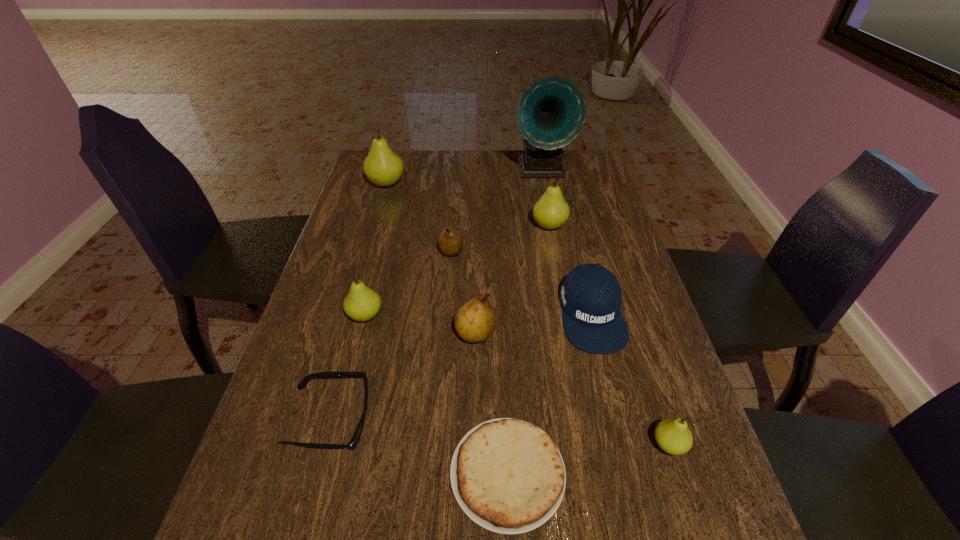
The width and height of the screenshot is (960, 540). Find the location of `the tallest object`. the tallest object is located at coordinates (551, 112).

This screenshot has height=540, width=960. Find the location of `the biggest green pear`. the biggest green pear is located at coordinates (383, 167).

At what (x,y) coordinates should I click in order to perform the action: click on the farthest green pear. Please return your answer as a coordinate pair (x, y). The image size is (960, 540). Looking at the image, I should click on (383, 167).

Image resolution: width=960 pixels, height=540 pixels. I want to click on the third farthest object, so click(x=551, y=211).

This screenshot has height=540, width=960. In order to click on the fifth shortest pear in this screenshot , I will do `click(551, 211)`.

Locate an element on the screen. The height and width of the screenshot is (540, 960). the second nearest green pear is located at coordinates (362, 303).

I want to click on the bigger brown pear, so click(475, 321).

Locate an element on the screen. This screenshot has height=540, width=960. blue baseball cap is located at coordinates point(591,296).

Locate an element on the screen. This screenshot has height=540, width=960. the farther brown pear is located at coordinates (450, 242).

This screenshot has width=960, height=540. Identify the location of the seventh nearest object. (450, 242).